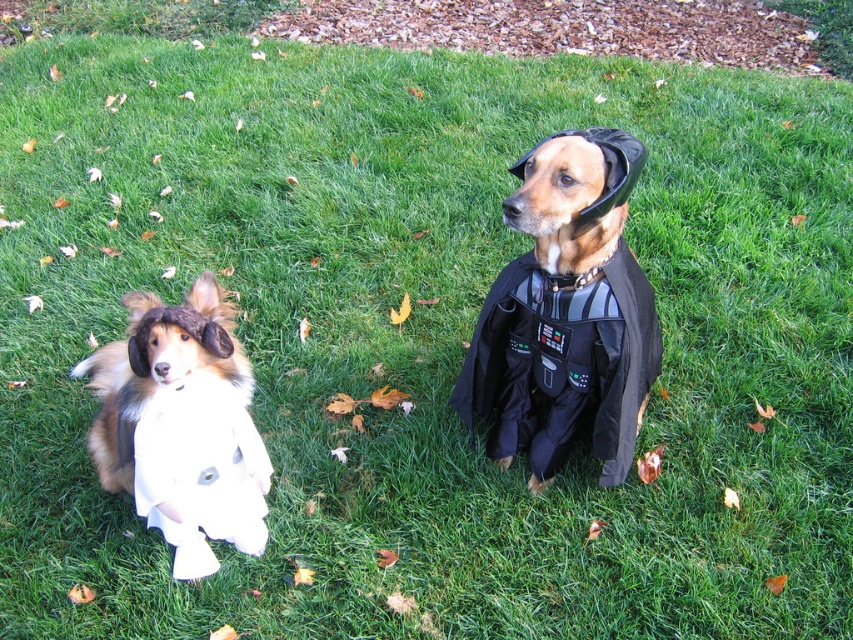
Question: Among these objects, which one is farthest from the camera?

Choices:
 (A) white soft ghost at left
 (B) black matte costume at center

Answer: (B)

Question: Is white soft ghost at left thinner than white fabric dress at left?

Choices:
 (A) yes
 (B) no

Answer: (B)

Question: Is the position of black matte costume at center more distant than that of white fabric dress at left?

Choices:
 (A) no
 (B) yes

Answer: (A)

Question: Among these objects, which one is farthest from the camera?

Choices:
 (A) white soft ghost at left
 (B) white fabric dress at left

Answer: (B)

Question: Does black matte costume at center appear on the right side of white fabric dress at left?

Choices:
 (A) no
 (B) yes

Answer: (B)

Question: Which point is closer to the camera?

Choices:
 (A) (157, 452)
 (B) (527, 189)
 (C) (213, 490)

Answer: (B)